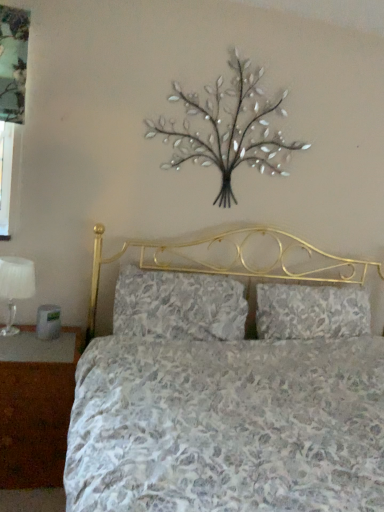
Question: Is metallic silver tree at upper center at the right side of floral fabric pillow at center, the second pillow from the right?

Choices:
 (A) yes
 (B) no

Answer: (A)

Question: Is metallic silver tree at upper center turned away from floral fabric pillow at center, the second pillow from the right?

Choices:
 (A) no
 (B) yes

Answer: (A)

Question: Is metallic silver tree at upper center positioned before floral fabric pillow at center, which is counted as the first pillow, starting from the left?

Choices:
 (A) yes
 (B) no

Answer: (B)

Question: From a real-world perspective, is metallic silver tree at upper center below floral fabric pillow at center, which is counted as the first pillow, starting from the left?

Choices:
 (A) no
 (B) yes

Answer: (A)

Question: Can you confirm if metallic silver tree at upper center is taller than floral fabric pillow at center, the second pillow from the right?

Choices:
 (A) yes
 (B) no

Answer: (A)

Question: Does metallic silver tree at upper center lie behind floral fabric pillow at center, the second pillow from the right?

Choices:
 (A) no
 (B) yes

Answer: (B)

Question: Can you confirm if white fabric lampshade at left is positioned to the left of floral fabric pillow at center, the 1th pillow viewed from the right?

Choices:
 (A) no
 (B) yes

Answer: (B)

Question: Is white fabric lampshade at left completely or partially outside of floral fabric pillow at center, placed as the second pillow when sorted from left to right?

Choices:
 (A) yes
 (B) no

Answer: (A)

Question: Does white fabric lampshade at left have a lesser width compared to floral fabric pillow at center, placed as the second pillow when sorted from left to right?

Choices:
 (A) no
 (B) yes

Answer: (B)

Question: From a real-world perspective, is white fabric lampshade at left on floral fabric pillow at center, placed as the second pillow when sorted from left to right?

Choices:
 (A) yes
 (B) no

Answer: (B)

Question: Is white fabric lampshade at left at the right side of floral fabric pillow at center, the 1th pillow viewed from the right?

Choices:
 (A) yes
 (B) no

Answer: (B)

Question: Is white fabric lampshade at left surrounding floral fabric pillow at center, placed as the second pillow when sorted from left to right?

Choices:
 (A) no
 (B) yes

Answer: (A)

Question: From the image's perspective, does white fabric lampshade at left appear higher than brown wood nightstand at lower left?

Choices:
 (A) no
 (B) yes

Answer: (B)